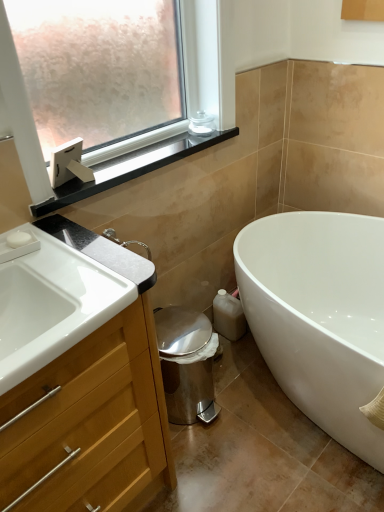
Question: Is clear glass jar at upper center wider than black glossy window sill at upper left?

Choices:
 (A) yes
 (B) no

Answer: (B)

Question: Is clear glass jar at upper center positioned far away from black glossy window sill at upper left?

Choices:
 (A) yes
 (B) no

Answer: (B)

Question: Considering the relative positions of clear glass jar at upper center and black glossy window sill at upper left in the image provided, is clear glass jar at upper center in front of black glossy window sill at upper left?

Choices:
 (A) no
 (B) yes

Answer: (A)

Question: Can you confirm if clear glass jar at upper center is positioned to the left of black glossy window sill at upper left?

Choices:
 (A) yes
 (B) no

Answer: (B)

Question: Is clear glass jar at upper center thinner than black glossy window sill at upper left?

Choices:
 (A) no
 (B) yes

Answer: (B)

Question: Is clear glass jar at upper center bigger than black glossy window sill at upper left?

Choices:
 (A) yes
 (B) no

Answer: (B)

Question: Does white matte soap at upper left have a greater width compared to black glossy window sill at upper left?

Choices:
 (A) yes
 (B) no

Answer: (B)

Question: From a real-world perspective, is white matte soap at upper left below black glossy window sill at upper left?

Choices:
 (A) no
 (B) yes

Answer: (B)

Question: From the image's perspective, does white matte soap at upper left appear lower than black glossy window sill at upper left?

Choices:
 (A) yes
 (B) no

Answer: (A)

Question: Is white matte soap at upper left positioned behind black glossy window sill at upper left?

Choices:
 (A) yes
 (B) no

Answer: (B)

Question: Is white matte soap at upper left facing towards black glossy window sill at upper left?

Choices:
 (A) no
 (B) yes

Answer: (A)

Question: Does white matte soap at upper left appear on the right side of black glossy window sill at upper left?

Choices:
 (A) yes
 (B) no

Answer: (B)

Question: Would you say white glossy bathtub at lower right is a long distance from wooden cabinet at left?

Choices:
 (A) no
 (B) yes

Answer: (A)